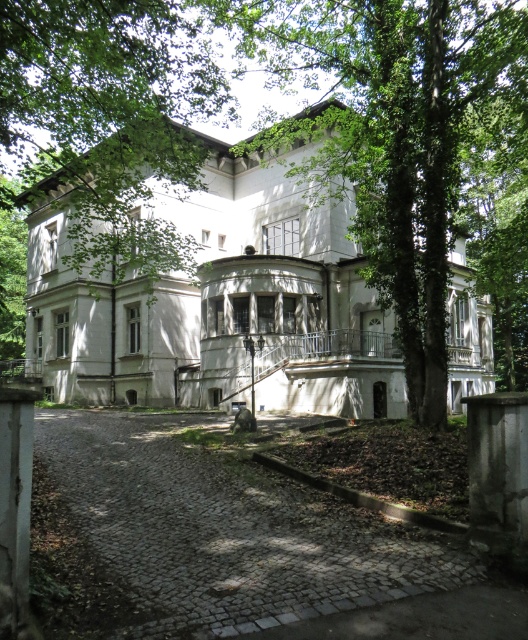
Is point (440, 392) farther from camera compared to point (274, 509)?

Yes, point (440, 392) is farther from viewer.

Does green leafy tree at center have a lesser height compared to cobblestone driveway at lower center?

No, green leafy tree at center is not shorter than cobblestone driveway at lower center.

The width and height of the screenshot is (528, 640). In order to click on green leafy tree at center in this screenshot , I will do `click(411, 148)`.

Locate an element on the screen. Image resolution: width=528 pixels, height=640 pixels. green leafy tree at center is located at coordinates (411, 148).

Is white stucco mansion at center shorter than white stone pillar at left?

Incorrect, white stucco mansion at center's height does not fall short of white stone pillar at left's.

Is point (190, 349) less distant than point (8, 456)?

No, it is not.

Where is `white stucco mansion at center`? white stucco mansion at center is located at coordinates (219, 307).

Does cobblestone driveway at lower center appear under white stone pillar at left?

Yes.

Is cobblestone driveway at lower center above white stone pillar at left?

No, cobblestone driveway at lower center is not above white stone pillar at left.

Locate an element on the screen. The width and height of the screenshot is (528, 640). cobblestone driveway at lower center is located at coordinates (254, 545).